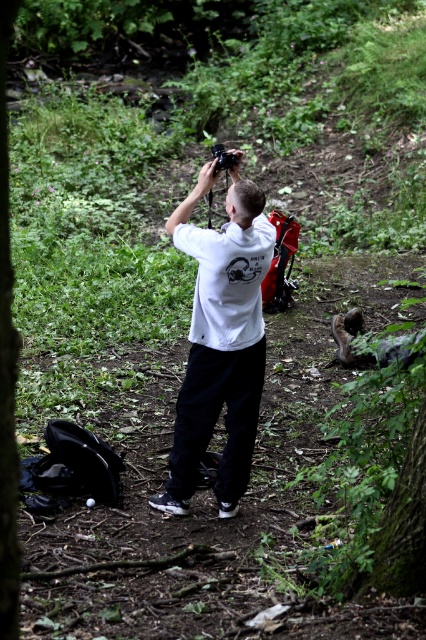
Question: Which point is farther from the camera taking this photo?

Choices:
 (A) (5, 248)
 (B) (230, 202)

Answer: (B)

Question: Which point appears farthest from the camera in this image?

Choices:
 (A) (176, 509)
 (B) (13, 413)

Answer: (A)

Question: Can you confirm if white matte hoodie at center is positioned to the right of green leafy tree at center?

Choices:
 (A) yes
 (B) no

Answer: (A)

Question: Is white matte hoodie at center to the right of green leafy tree at center from the viewer's perspective?

Choices:
 (A) yes
 (B) no

Answer: (A)

Question: Can you confirm if white matte hoodie at center is positioned above green leafy tree at center?

Choices:
 (A) yes
 (B) no

Answer: (B)